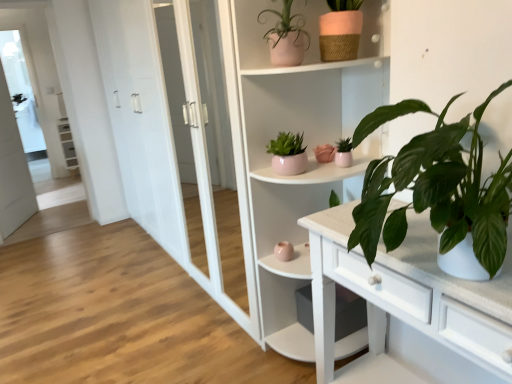
Question: Can you confirm if matte pink pot at center, which is counted as the 3th houseplant, starting from the top, is smaller than matte pink pot at upper center, which is the 1th houseplant in top-to-bottom order?

Choices:
 (A) no
 (B) yes

Answer: (B)

Question: Can you confirm if matte pink pot at center, which is counted as the 2th houseplant, starting from the bottom, is thinner than matte pink pot at upper center, which is the 4th houseplant from bottom to top?

Choices:
 (A) no
 (B) yes

Answer: (B)

Question: Can you confirm if matte pink pot at center, which is counted as the 2th houseplant, starting from the bottom, is wider than matte pink pot at upper center, which is the 1th houseplant in top-to-bottom order?

Choices:
 (A) no
 (B) yes

Answer: (A)

Question: Is matte pink pot at center, which is counted as the 2th houseplant, starting from the bottom, outside of matte pink pot at upper center, which is the 4th houseplant from bottom to top?

Choices:
 (A) no
 (B) yes

Answer: (B)

Question: Is matte pink pot at center, which is counted as the 2th houseplant, starting from the bottom, positioned far away from matte pink pot at upper center, which is the 1th houseplant in top-to-bottom order?

Choices:
 (A) yes
 (B) no

Answer: (B)

Question: Considering the positions of point (337, 160) and point (5, 94), is point (337, 160) closer or farther from the camera than point (5, 94)?

Choices:
 (A) closer
 (B) farther

Answer: (A)

Question: Looking at the image, does matte pink pot at center, which is counted as the 2th houseplant, starting from the bottom, seem bigger or smaller compared to white glass screen door at left?

Choices:
 (A) small
 (B) big

Answer: (A)

Question: From a real-world perspective, is matte pink pot at center, which is counted as the 2th houseplant, starting from the bottom, positioned above or below white glass screen door at left?

Choices:
 (A) above
 (B) below

Answer: (A)

Question: Is matte pink pot at center, which is counted as the 3th houseplant, starting from the top, taller or shorter than white glass screen door at left?

Choices:
 (A) short
 (B) tall

Answer: (A)

Question: Considering the positions of matte pink pot at center, which is counted as the 3th houseplant, starting from the top, and white glass window at upper left in the image, is matte pink pot at center, which is counted as the 3th houseplant, starting from the top, wider or thinner than white glass window at upper left?

Choices:
 (A) wide
 (B) thin

Answer: (B)

Question: Visually, is matte pink pot at center, which is counted as the 2th houseplant, starting from the bottom, positioned to the left or to the right of white glass window at upper left?

Choices:
 (A) left
 (B) right

Answer: (B)

Question: Would you say matte pink pot at center, which is counted as the 3th houseplant, starting from the top, is inside or outside white glass window at upper left?

Choices:
 (A) outside
 (B) inside

Answer: (A)

Question: From the image's perspective, is matte pink pot at center, which is counted as the 3th houseplant, starting from the top, above or below white glass window at upper left?

Choices:
 (A) below
 (B) above

Answer: (A)

Question: In the image, is white matte bookshelf at center positioned in front of or behind matte gray cabinet at left?

Choices:
 (A) behind
 (B) front

Answer: (B)

Question: In terms of width, does white matte bookshelf at center look wider or thinner when compared to matte gray cabinet at left?

Choices:
 (A) wide
 (B) thin

Answer: (A)